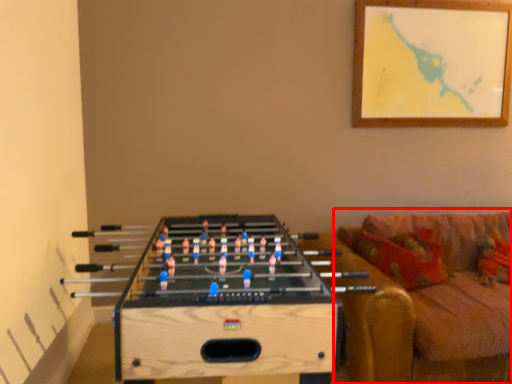
Question: From the image's perspective, considering the relative positions of studio couch (annotated by the red box) and table in the image provided, where is studio couch (annotated by the red box) located with respect to the staircase?

Choices:
 (A) above
 (B) below

Answer: (A)